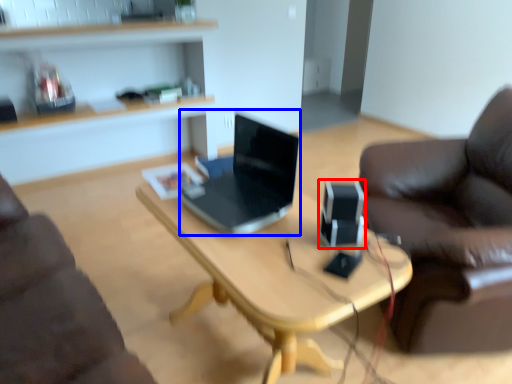
Question: Which point is further to the camera, speaker (highlighted by a red box) or laptop (highlighted by a blue box)?

Choices:
 (A) speaker
 (B) laptop

Answer: (A)